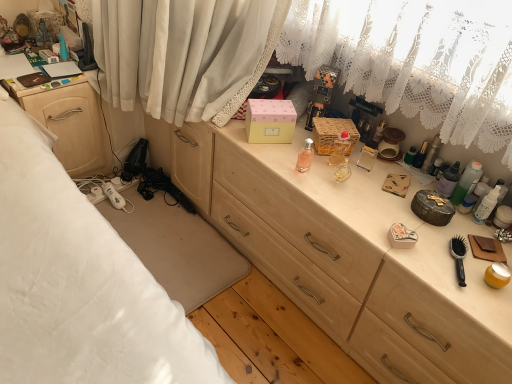
This screenshot has height=384, width=512. Find the location of `vacant area that is in front of woven brown picnic basket at center`. vacant area that is in front of woven brown picnic basket at center is located at coordinates (316, 178).